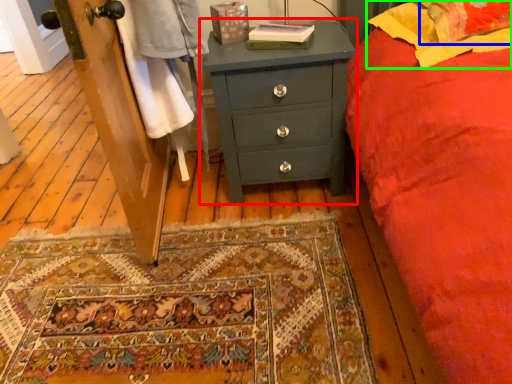
Question: Which is farther away from chest of drawers (highlighted by a red box)? pillow (highlighted by a blue box) or pillow (highlighted by a green box)?

Choices:
 (A) pillow
 (B) pillow

Answer: (A)